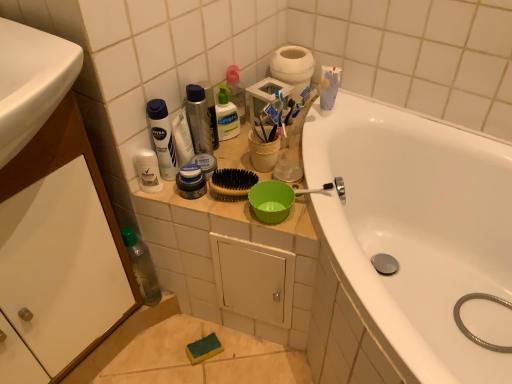
Question: From the image's perspective, relative to clear plastic bottle at upper center, the 2th cleaning product in the right-to-left sequence, is white matte deodorant at upper center, the 1th cleaning product in the left-to-right sequence, above or below?

Choices:
 (A) above
 (B) below

Answer: (B)

Question: In terms of width, does white matte deodorant at upper center, the fourth cleaning product from the right, look wider or thinner when compared to clear plastic bottle at upper center, which is the 3th cleaning product from left to right?

Choices:
 (A) thin
 (B) wide

Answer: (A)

Question: Estimate the real-world distances between objects in this image. Which object is closer to the white glossy bathtub at upper right?

Choices:
 (A) translucent plastic bottle at upper center, acting as the first cleaning product starting from the right
 (B) clear plastic shaving cream canister at upper left
 (C) metallic silver spray can at upper center, arranged as the third cleaning product when viewed from the right
 (D) white cardboard toilet paper at upper center
 (E) white matte toothpaste at upper center

Answer: (D)

Question: Estimate the real-world distances between objects in this image. Which object is closer to the white matte deodorant at upper center, the fourth cleaning product from the right?

Choices:
 (A) matte blue cream at center, the second personal care from the top
 (B) metallic silver can at upper center, which appears as the second personal care when ordered from the bottom
 (C) translucent plastic bottle at upper center, acting as the 4th cleaning product starting from the left
 (D) white matte toothpaste at upper center
 (E) transparent plastic bottle at lower left

Answer: (A)